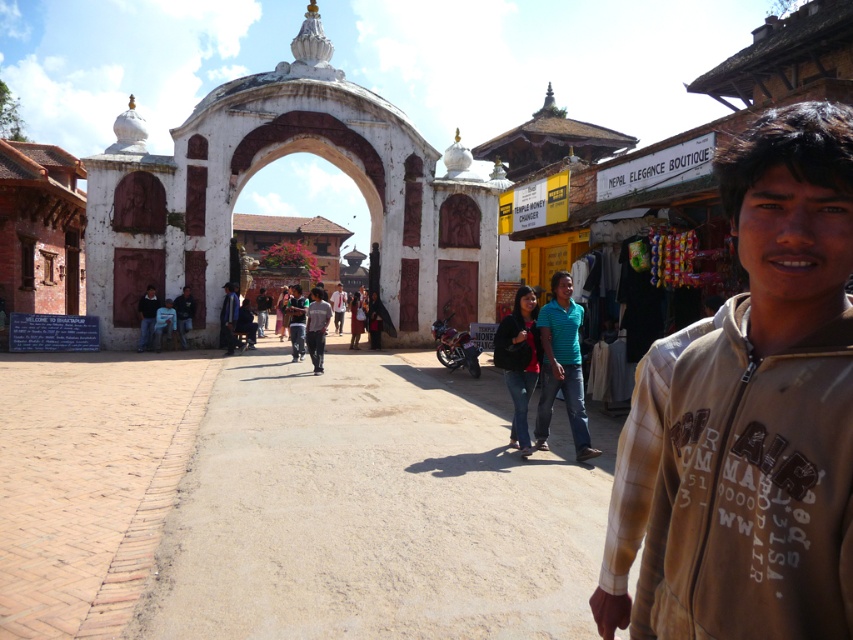
Which of these two, matte black jacket at center or light brown leather jacket at center, stands shorter?

With less height is light brown leather jacket at center.

The width and height of the screenshot is (853, 640). In order to click on matte black jacket at center in this screenshot , I will do `click(519, 360)`.

Is point (496, 336) in front of point (230, 300)?

Yes, it is.

Does point (532, 381) come behind point (234, 333)?

No, it is not.

Locate an element on the screen. This screenshot has width=853, height=640. matte black jacket at center is located at coordinates (519, 360).

Based on the photo, can you confirm if dark gray shirt at center is positioned below dark blue shirt at lower left?

Yes.

Can you confirm if dark gray shirt at center is shorter than dark blue shirt at lower left?

In fact, dark gray shirt at center may be taller than dark blue shirt at lower left.

Between point (309, 323) and point (154, 323), which one is positioned in front?

Point (309, 323) is in front.

I want to click on dark gray shirt at center, so (316, 326).